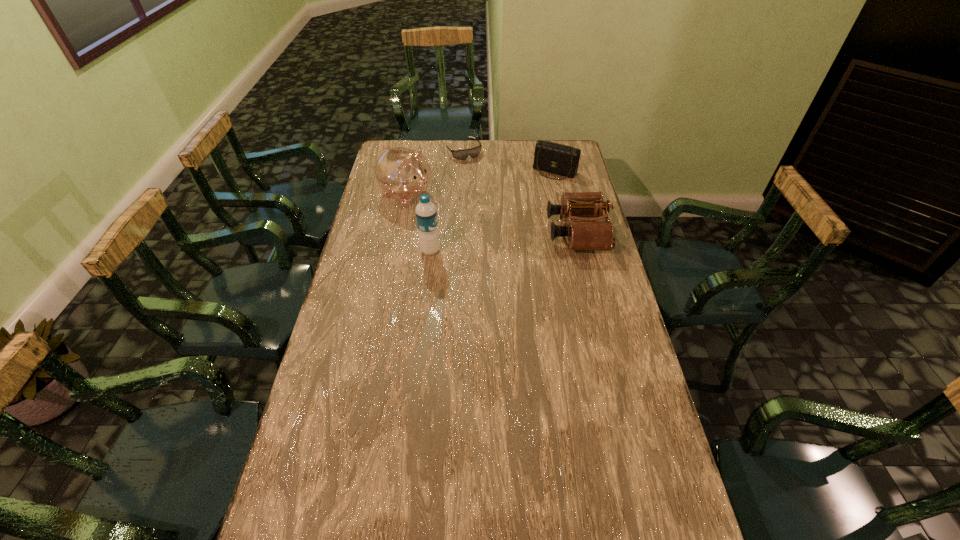
Where is `vacant space that satisfies the following two spatial constraints: 1. on the front side of the water bottle; 2. on the label of the piggy bank`? vacant space that satisfies the following two spatial constraints: 1. on the front side of the water bottle; 2. on the label of the piggy bank is located at coordinates click(x=396, y=251).

The height and width of the screenshot is (540, 960). What are the coordinates of `free space that satisfies the following two spatial constraints: 1. on the front side of the piggy bank; 2. on the label of the water bottle` in the screenshot? It's located at (396, 251).

Identify the location of free location that satisfies the following two spatial constraints: 1. on the front side of the piggy bank; 2. on the label of the water bottle. Image resolution: width=960 pixels, height=540 pixels. (396, 251).